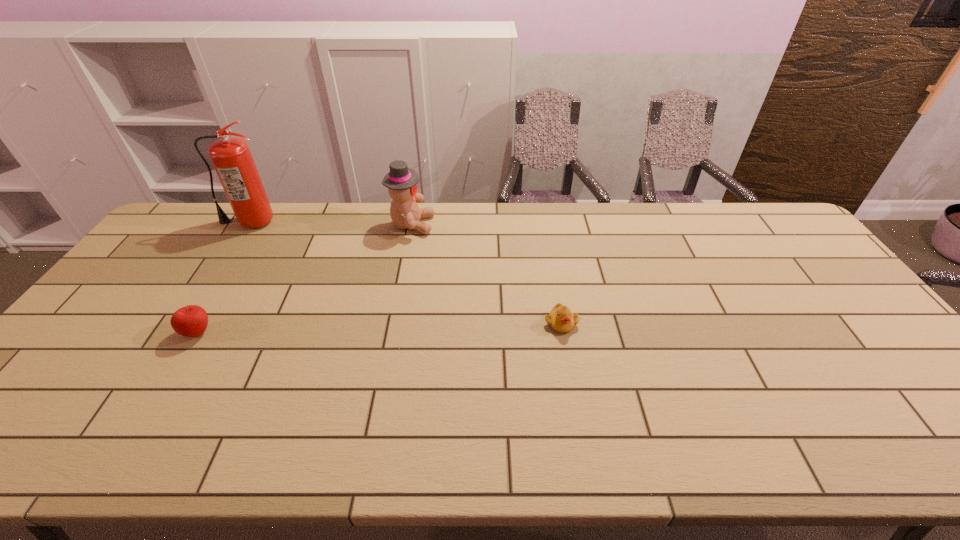
Image resolution: width=960 pixels, height=540 pixels. What are the coordinates of `unoccupied area between the fire extinguisher and the third tallest object` in the screenshot? It's located at (224, 277).

I want to click on free space that is in between the tallest object and the duckling, so click(405, 272).

Where is `free space between the apple and the shortest object`? This screenshot has width=960, height=540. free space between the apple and the shortest object is located at coordinates (379, 328).

Locate an element on the screen. vacant region between the duckling and the fire extinguisher is located at coordinates (405, 272).

Locate an element on the screen. vacant area that lies between the third tallest object and the duckling is located at coordinates (379, 328).

Identify the location of free space between the fire extinguisher and the second object from right to left. click(x=330, y=223).

Locate an element on the screen. The width and height of the screenshot is (960, 540). vacant space that's between the apple and the shortest object is located at coordinates (379, 328).

Image resolution: width=960 pixels, height=540 pixels. What are the coordinates of `empty location between the fire extinguisher and the duckling` in the screenshot? It's located at (405, 272).

Image resolution: width=960 pixels, height=540 pixels. Identify the location of object that is the nearest to the shortest object. (401, 181).

Choose which object is the nearest neighbor to the rightmost object. Please provide its 2D coordinates. Your answer should be formatted as a tuple, i.e. [(x, y)], where the tuple contains the x and y coordinates of a point satisfying the conditions above.

[(401, 181)]